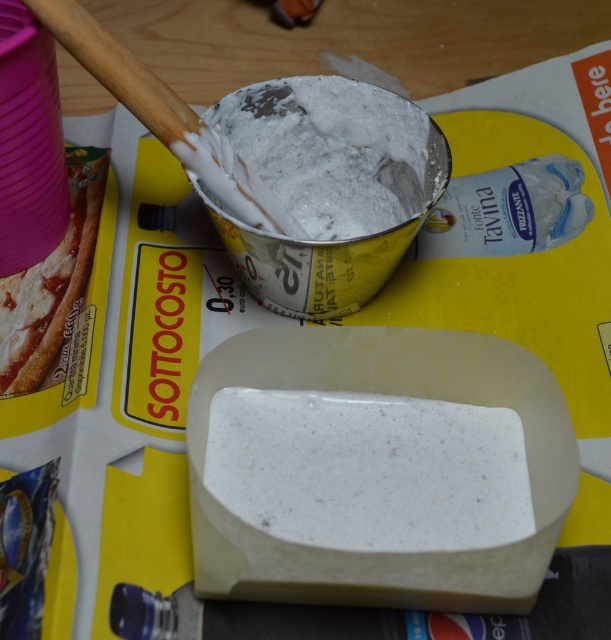
You are a delivery person who needs to place a new pizza box on the workspace. The pizza box is 14 inches wide. There is already a white speckled soap at center and a matte cardboard pizza at upper left on the table. Can you fit the pizza box between them without overlapping?

The distance between the white speckled soap at center and the matte cardboard pizza at upper left is 13.79 inches. Since the pizza box is 14 inches wide, it cannot fit between them without overlapping.

What are the coordinates of the white speckled soap at center?

The white speckled soap at center is located at coordinates point (x=331, y=150).

You are a customer at a craft store and see the white speckled soap at center and the matte cardboard pizza at upper left on the workspace. Which object is positioned higher on the workspace surface?

The white speckled soap at center is located above the matte cardboard pizza at upper left, so it is positioned higher on the workspace surface.